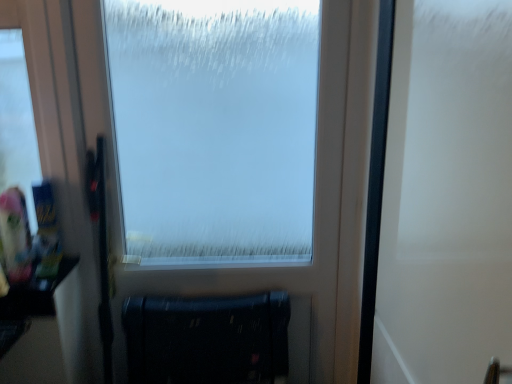
Question: Can you see white matte screen door at right touching matte black radiator at lower center?

Choices:
 (A) no
 (B) yes

Answer: (A)

Question: Does white matte screen door at right lie in front of matte black radiator at lower center?

Choices:
 (A) yes
 (B) no

Answer: (A)

Question: Would you say white matte screen door at right is outside matte black radiator at lower center?

Choices:
 (A) yes
 (B) no

Answer: (A)

Question: Is white matte screen door at right at the right side of matte black radiator at lower center?

Choices:
 (A) yes
 (B) no

Answer: (A)

Question: Are white matte screen door at right and matte black radiator at lower center located far from each other?

Choices:
 (A) no
 (B) yes

Answer: (A)

Question: From the image's perspective, does white matte screen door at right appear higher than matte black radiator at lower center?

Choices:
 (A) yes
 (B) no

Answer: (A)

Question: Considering the relative sizes of frosted glass window at center and white matte screen door at right in the image provided, is frosted glass window at center smaller than white matte screen door at right?

Choices:
 (A) yes
 (B) no

Answer: (A)

Question: Is there a large distance between frosted glass window at center and white matte screen door at right?

Choices:
 (A) yes
 (B) no

Answer: (B)

Question: Considering the relative positions of frosted glass window at center and white matte screen door at right in the image provided, is frosted glass window at center behind white matte screen door at right?

Choices:
 (A) no
 (B) yes

Answer: (B)

Question: Is frosted glass window at center to the right of white matte screen door at right from the viewer's perspective?

Choices:
 (A) yes
 (B) no

Answer: (B)

Question: From a real-world perspective, is frosted glass window at center physically above white matte screen door at right?

Choices:
 (A) no
 (B) yes

Answer: (A)

Question: Is frosted glass window at center taller than white matte screen door at right?

Choices:
 (A) no
 (B) yes

Answer: (B)

Question: Is matte black radiator at lower center closer to camera compared to white matte screen door at right?

Choices:
 (A) no
 (B) yes

Answer: (A)